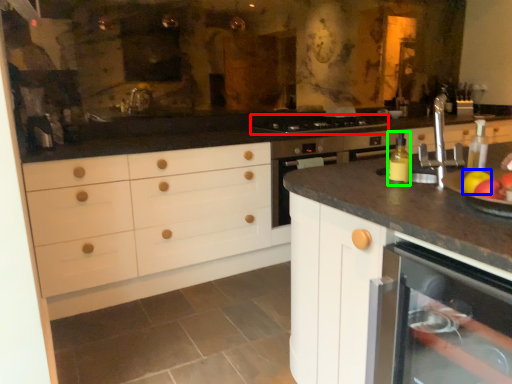
Question: Based on their relative distances, which object is farther from gas stove (highlighted by a red box)? Choose from apple (highlighted by a blue box) and bottle (highlighted by a green box).

Choices:
 (A) apple
 (B) bottle

Answer: (A)